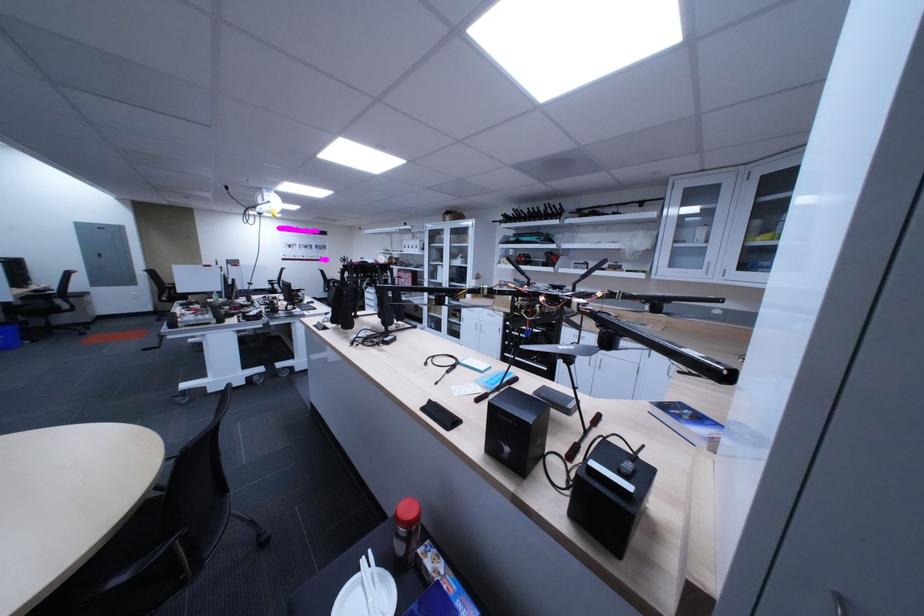
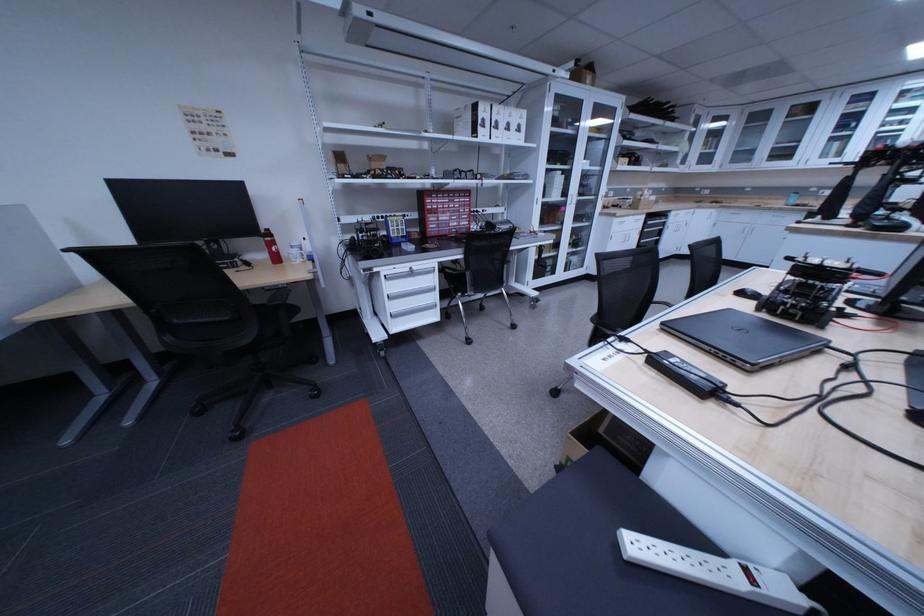
The point at (x=478, y=323) is marked in the first image. Where is the corresponding point in the second image?

(626, 241)